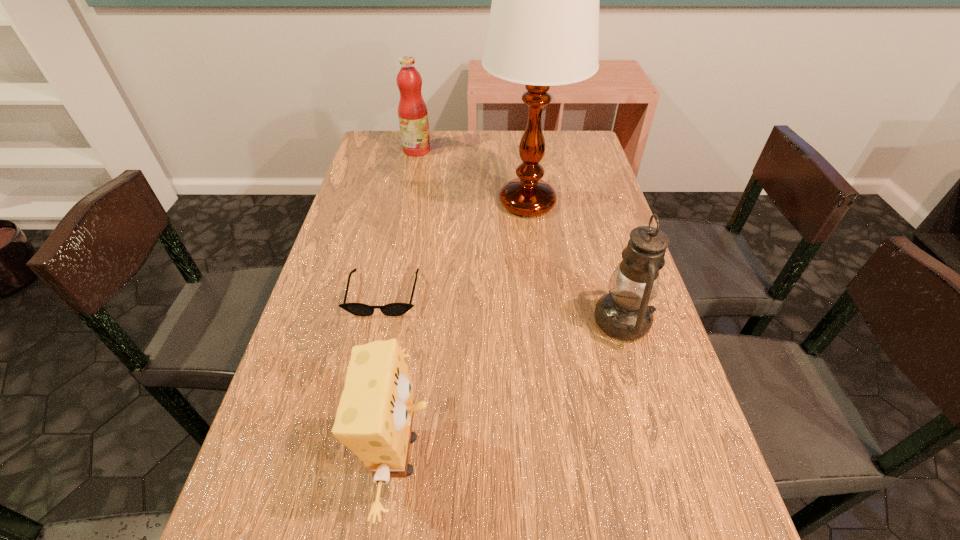
This screenshot has height=540, width=960. In order to click on the tallest object in this screenshot , I will do `click(543, 30)`.

This screenshot has width=960, height=540. I want to click on table lamp, so click(543, 30).

Identify the location of fruit juice. The image size is (960, 540). (412, 111).

Find the location of a particular element. The height and width of the screenshot is (540, 960). oil lamp is located at coordinates (624, 313).

Where is `the shortest object`? the shortest object is located at coordinates (393, 309).

This screenshot has width=960, height=540. What are the coordinates of `free space located on the left of the table lamp` in the screenshot? It's located at (368, 202).

This screenshot has height=540, width=960. In order to click on vacant region located 0.060m on the front label of the farthest object in this screenshot , I will do 448,150.

What are the coordinates of `blank space located on the front of the oil lamp` in the screenshot? It's located at (657, 435).

You are a GUI agent. You are given a task and a screenshot of the screen. Output one action in this format:
    pyautogui.click(x=<x>, y=<y>)
    Task: Click on the vacant space located 0.390m on the front-facing side of the shortest object
    This screenshot has width=960, height=540.
    Given the screenshot: What is the action you would take?
    pyautogui.click(x=339, y=504)

The image size is (960, 540). Identify the location of object situated at the far edge. (412, 111).